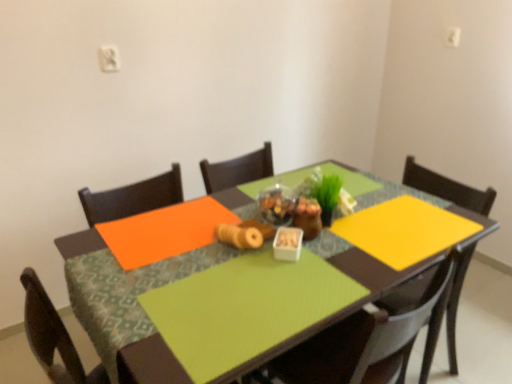
Question: From a real-world perspective, does white matte container at center stand above matte brown chair at center?

Choices:
 (A) yes
 (B) no

Answer: (A)

Question: From the image's perspective, would you say white matte container at center is positioned over matte brown chair at center?

Choices:
 (A) no
 (B) yes

Answer: (B)

Question: From the image's perspective, is white matte container at center below matte brown chair at center?

Choices:
 (A) yes
 (B) no

Answer: (B)

Question: From a real-world perspective, is white matte container at center under matte brown chair at center?

Choices:
 (A) no
 (B) yes

Answer: (A)

Question: Is white matte container at center to the right of matte brown chair at center from the viewer's perspective?

Choices:
 (A) yes
 (B) no

Answer: (B)

Question: Are white matte container at center and matte brown chair at center beside each other?

Choices:
 (A) no
 (B) yes

Answer: (A)

Question: From the image's perspective, is green matte plant at center below white matte container at center?

Choices:
 (A) yes
 (B) no

Answer: (B)

Question: Is green matte plant at center closer to camera compared to white matte container at center?

Choices:
 (A) no
 (B) yes

Answer: (A)

Question: Does green matte plant at center have a larger size compared to white matte container at center?

Choices:
 (A) yes
 (B) no

Answer: (A)

Question: Would you say green matte plant at center is a long distance from white matte container at center?

Choices:
 (A) no
 (B) yes

Answer: (A)

Question: From a real-world perspective, is green matte plant at center physically below white matte container at center?

Choices:
 (A) yes
 (B) no

Answer: (B)

Question: Could you tell me if green matte plant at center is facing white matte container at center?

Choices:
 (A) yes
 (B) no

Answer: (B)

Question: Is matte brown chair at center positioned with its back to green matte plant at center?

Choices:
 (A) no
 (B) yes

Answer: (A)